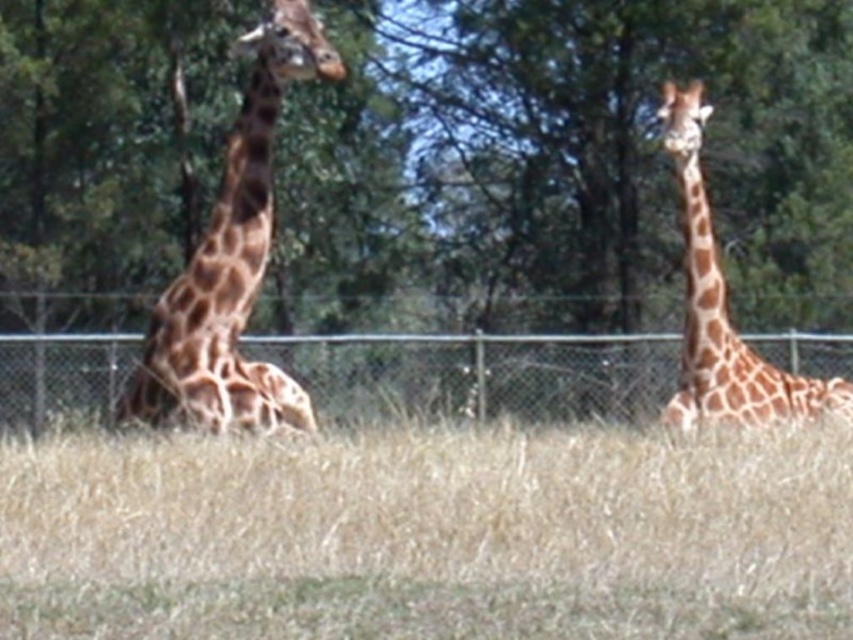
Does metallic chain-link fence at center have a smaller size compared to spotted brown giraffe at left?

Correct, metallic chain-link fence at center occupies less space than spotted brown giraffe at left.

Between metallic chain-link fence at center and spotted brown giraffe at left, which one is positioned lower?

metallic chain-link fence at center is below.

At what (x,y) coordinates should I click in order to perform the action: click on metallic chain-link fence at center. Please return your answer as a coordinate pair (x, y). Looking at the image, I should click on (479, 372).

This screenshot has height=640, width=853. Find the location of `metallic chain-link fence at center`. metallic chain-link fence at center is located at coordinates (479, 372).

Consider the image. Can you confirm if dry grass at lower center is wider than spotted brown giraffe at left?

Yes, dry grass at lower center is wider than spotted brown giraffe at left.

Can you confirm if dry grass at lower center is positioned to the right of spotted brown giraffe at left?

Yes, dry grass at lower center is to the right of spotted brown giraffe at left.

I want to click on dry grass at lower center, so click(428, 534).

Where is `dry grass at lower center`? The height and width of the screenshot is (640, 853). dry grass at lower center is located at coordinates (428, 534).

Is the position of spotted brown giraffe at left more distant than that of brown spotted giraffe at right?

No, spotted brown giraffe at left is in front of brown spotted giraffe at right.

Is point (263, 33) farther from viewer compared to point (753, 356)?

No, it is not.

Where is `spotted brown giraffe at left`? spotted brown giraffe at left is located at coordinates (231, 260).